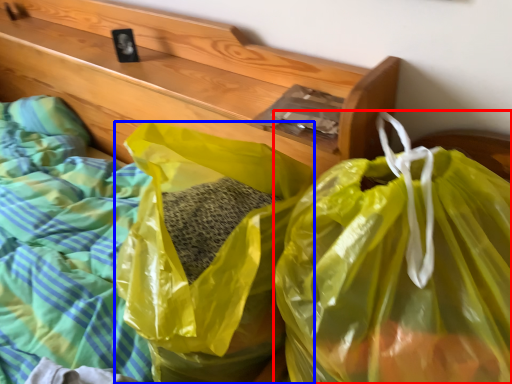
Question: Among these objects, which one is farthest to the camera, plastic bag (highlighted by a red box) or plastic bag (highlighted by a blue box)?

Choices:
 (A) plastic bag
 (B) plastic bag

Answer: (B)